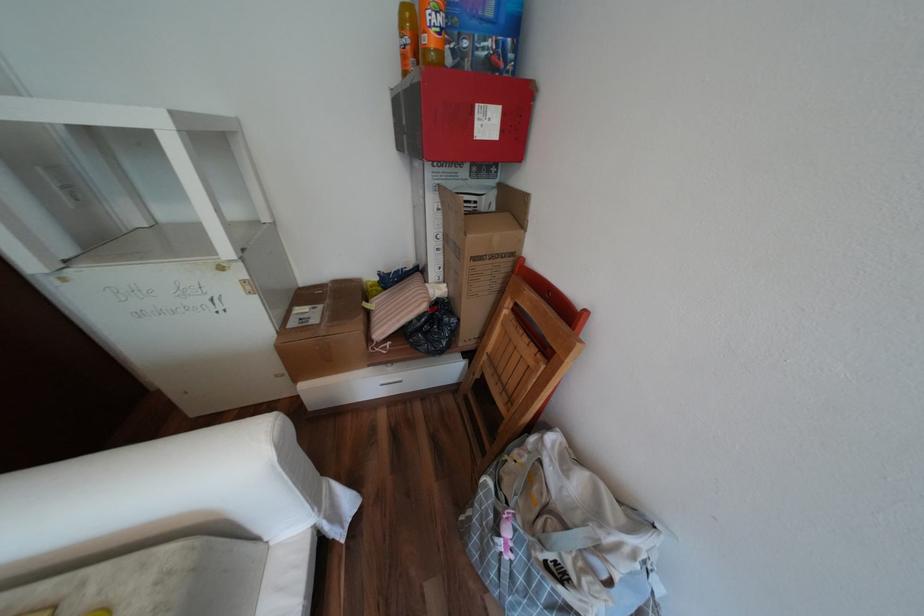
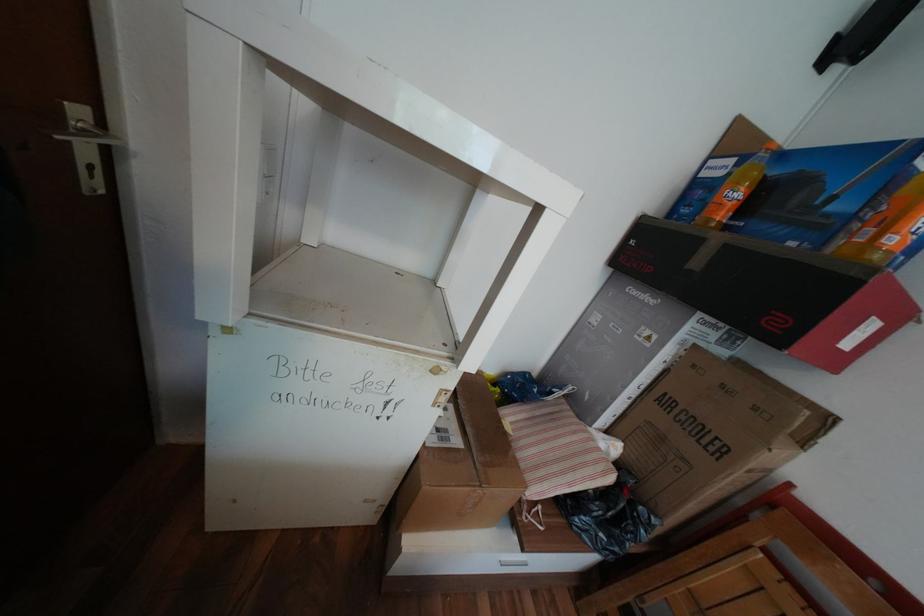
Question: The images are taken continuously from a first-person perspective. In which direction are you moving?

Choices:
 (A) Left
 (B) Right
 (C) Forward
 (D) Backward

Answer: (A)